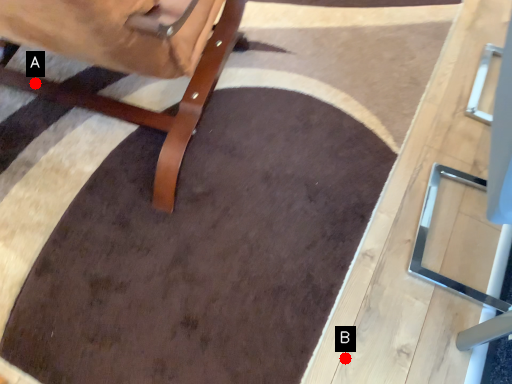
Question: Two points are circled on the image, labeled by A and B beside each circle. Which point is closer to the camera taking this photo?

Choices:
 (A) A is closer
 (B) B is closer

Answer: (B)